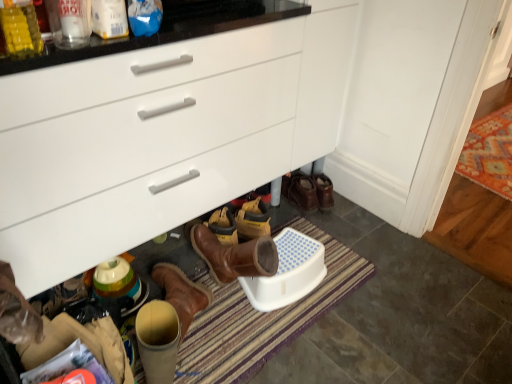
The image size is (512, 384). I want to click on blank space situated above striped fabric bath mat at lower center (from a real-world perspective), so (x=246, y=314).